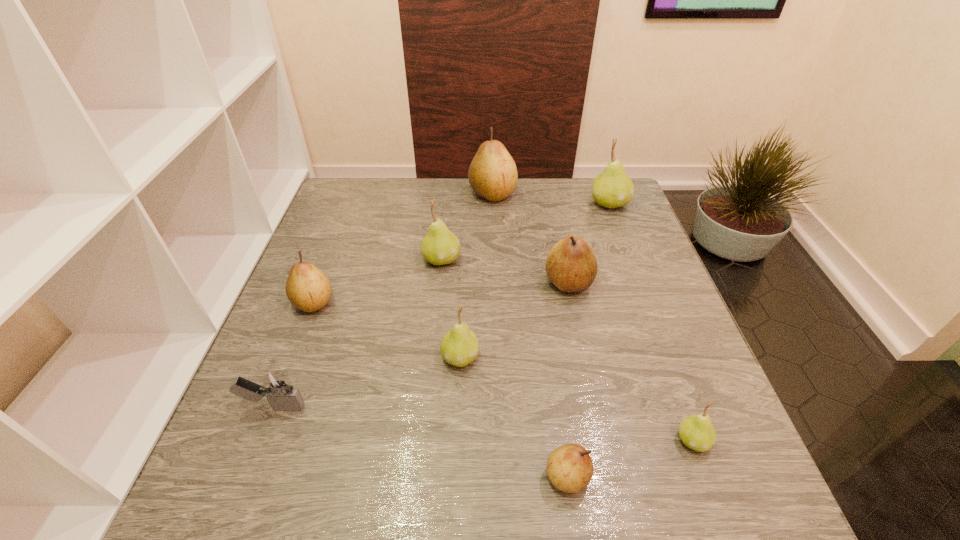
Where is `free space between the nearest brown pear and the second farthest green pear`? This screenshot has height=540, width=960. free space between the nearest brown pear and the second farthest green pear is located at coordinates (504, 368).

In order to click on free space that is in between the nearest green pear and the third biggest green pear in this screenshot , I will do `click(576, 398)`.

Where is `free space between the fourth nearest object and the gray igniter`? free space between the fourth nearest object and the gray igniter is located at coordinates coord(367,382).

Image resolution: width=960 pixels, height=540 pixels. Identify the location of unoccupied area between the smallest green pear and the third nearest object. (x=483, y=423).

You are a GUI agent. You are given a task and a screenshot of the screen. Output one action in this format:
    pyautogui.click(x=<x>, y=<y>)
    Task: Click on the free space between the third biggest green pear and the igniter
    
    Given the screenshot: What is the action you would take?
    pyautogui.click(x=367, y=382)

At what (x,y) coordinates should I click in order to perform the action: click on empty location between the second biggest brown pear and the biggest brown pear. Please return your answer as a coordinate pair (x, y). This screenshot has width=960, height=540. Looking at the image, I should click on [x=530, y=238].

Find the location of `empty space between the third nearest object and the second biggest brown pear`. empty space between the third nearest object and the second biggest brown pear is located at coordinates (421, 345).

This screenshot has height=540, width=960. In order to click on vacant space that is in between the farthest green pear and the second biggest brown pear in this screenshot , I will do `click(588, 243)`.

At what (x,y) coordinates should I click in order to perform the action: click on free spot between the farthest brown pear and the smallest green pear. Please return your answer as a coordinate pair (x, y). The width and height of the screenshot is (960, 540). Looking at the image, I should click on (592, 317).

Identify the location of the third closest object to the second biggest green pear. (571, 265).